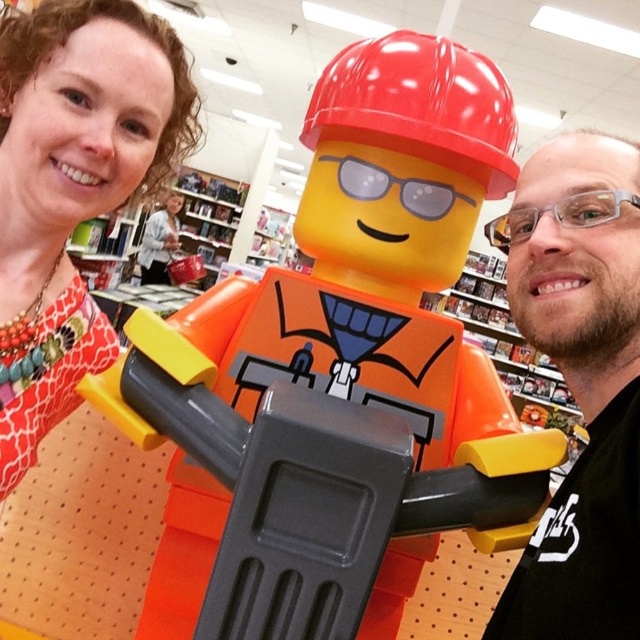
You are a customer in the LEGO store and you want to know which is taller between the matte orange plastic construction worker at center and the matte orange dress at center. Can you tell me?

The matte orange plastic construction worker at center is taller than the matte orange dress at center according to the description.

You are a customer in the LEGO store and you want to find the matte orange dress at center. Where should you look relative to the matte orange plastic construction worker at center?

The matte orange plastic construction worker at center is located below the matte orange dress at center, so you should look above the matte orange plastic construction worker at center to find the matte orange dress at center.

You are a customer in the LEGO store and see the matte orange plastic construction worker at center and the matte gray sweater at center. Which object is located to the right side of the other?

The matte orange plastic construction worker at center is positioned on the right side of the matte gray sweater at center.